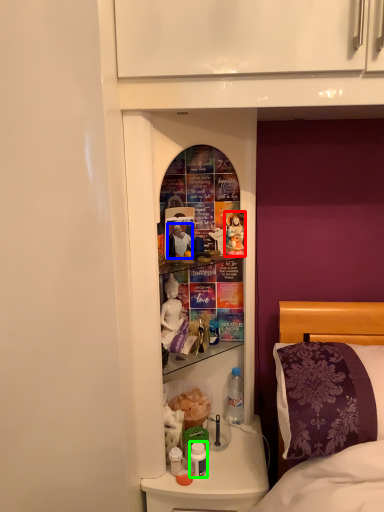
Question: Estimate the real-world distances between objects in this image. Which object is closer to doll (highlighted by a red box), person (highlighted by a blue box) or bottle (highlighted by a green box)?

Choices:
 (A) person
 (B) bottle

Answer: (A)